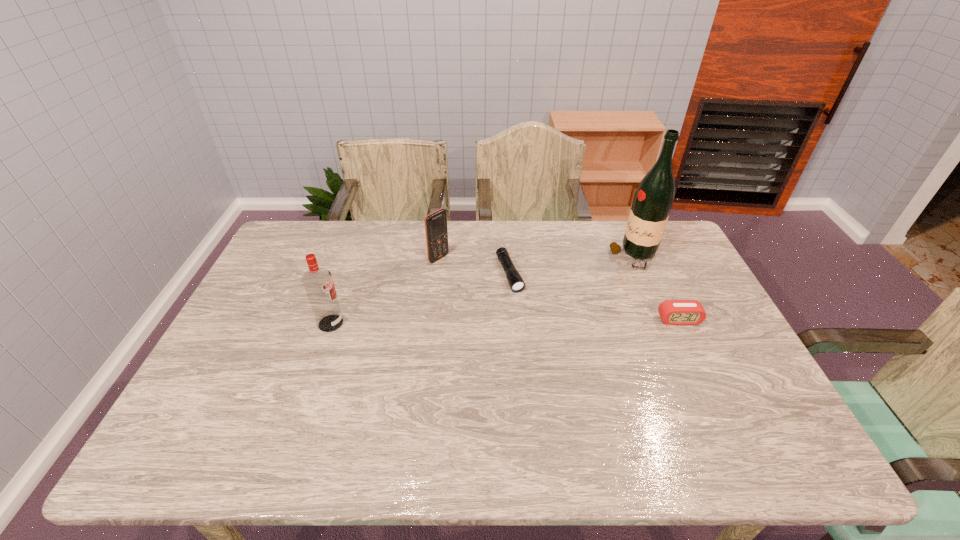
At what (x,y) coordinates should I click in order to perform the action: click on vacant space situated 0.270m on the surface of the tallest object. Please return your answer as a coordinate pair (x, y). The image size is (960, 540). Looking at the image, I should click on (559, 299).

Where is `free space located on the surface of the tallest object`? free space located on the surface of the tallest object is located at coordinates (587, 284).

What are the coordinates of `free location located 0.160m on the surface of the tallest object` in the screenshot? It's located at (585, 285).

This screenshot has width=960, height=540. In order to click on vacant area situated 0.210m on the screen of the third tallest object in this screenshot , I will do `click(492, 293)`.

Where is `vacant space situated 0.060m on the screen of the third tallest object`? vacant space situated 0.060m on the screen of the third tallest object is located at coordinates (458, 271).

Identify the location of vacant area situated 0.120m on the screen of the third tallest object. (471, 279).

This screenshot has height=540, width=960. Find the location of `free space located 0.250m at the lens end of the flashlight`. free space located 0.250m at the lens end of the flashlight is located at coordinates (544, 356).

This screenshot has height=540, width=960. Identify the location of vacant space located 0.250m at the lens end of the flashlight. (544, 356).

Find the location of a particular element. This screenshot has width=960, height=540. free space located 0.180m at the lens end of the flashlight is located at coordinates (535, 336).

This screenshot has width=960, height=540. I want to click on wine bottle that is at the far edge, so click(x=654, y=197).